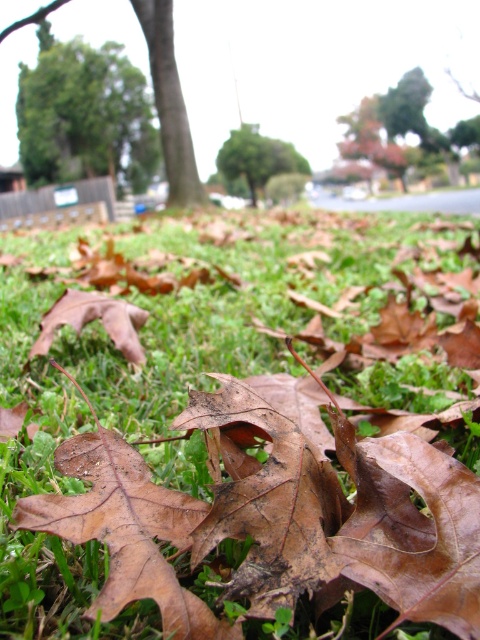
Is point (72, 616) less distant than point (79, 49)?

That is True.

Does green matte grass at center have a lesser height compared to green leafy tree at upper left?

Yes, green matte grass at center is shorter than green leafy tree at upper left.

Does point (285, 484) come in front of point (44, 179)?

Yes, point (285, 484) is in front of point (44, 179).

Where is `green matte grass at center`? green matte grass at center is located at coordinates (x=241, y=429).

In the scene shown: Which of these two, green matte grass at center or green leafy tree at center, stands shorter?

Standing shorter between the two is green matte grass at center.

Which is in front, point (440, 500) or point (256, 150)?

Positioned in front is point (440, 500).

Describe the element at coordinates (241, 429) in the screenshot. I see `green matte grass at center` at that location.

Find the location of `green matte grass at center`. green matte grass at center is located at coordinates (241, 429).

Locate an element on the screen. The height and width of the screenshot is (640, 480). green leafy tree at upper left is located at coordinates (84, 115).

Who is positioned more to the right, green leafy tree at upper left or green leafy tree at center?

From the viewer's perspective, green leafy tree at center appears more on the right side.

The width and height of the screenshot is (480, 640). Find the location of `green leafy tree at upper left`. green leafy tree at upper left is located at coordinates (84, 115).

Image resolution: width=480 pixels, height=640 pixels. Identify the location of green leafy tree at upper left. (84, 115).